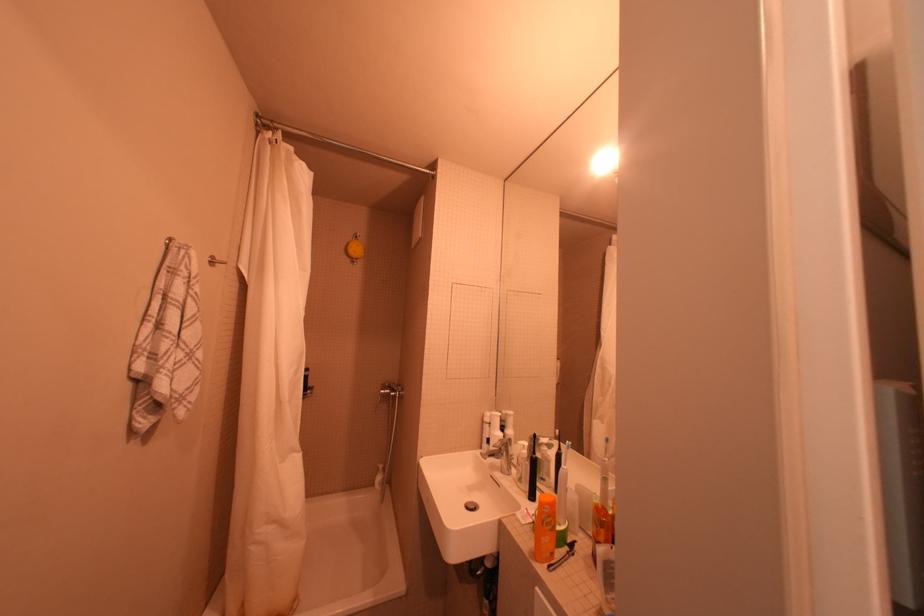
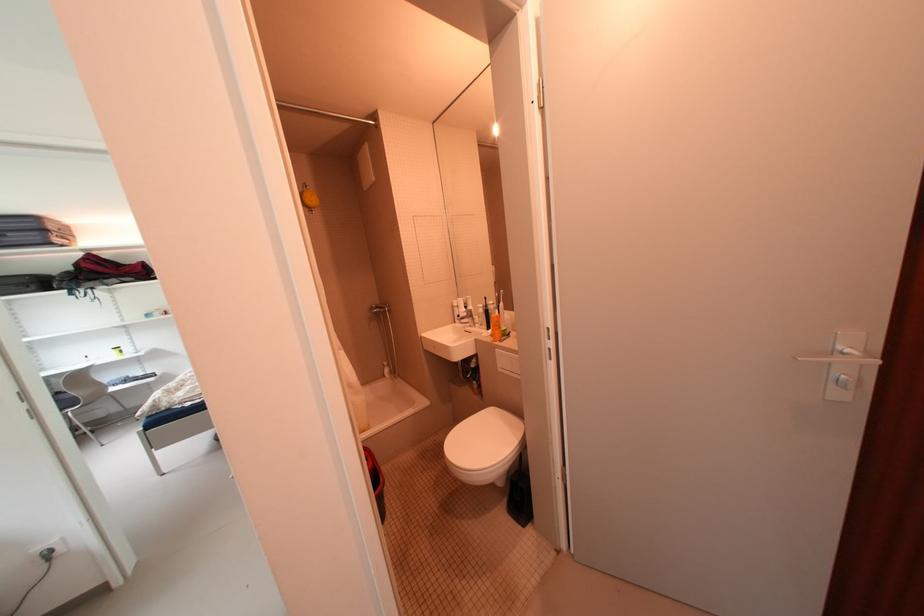
The point at (492, 422) is marked in the first image. Where is the corresponding point in the second image?

(460, 308)